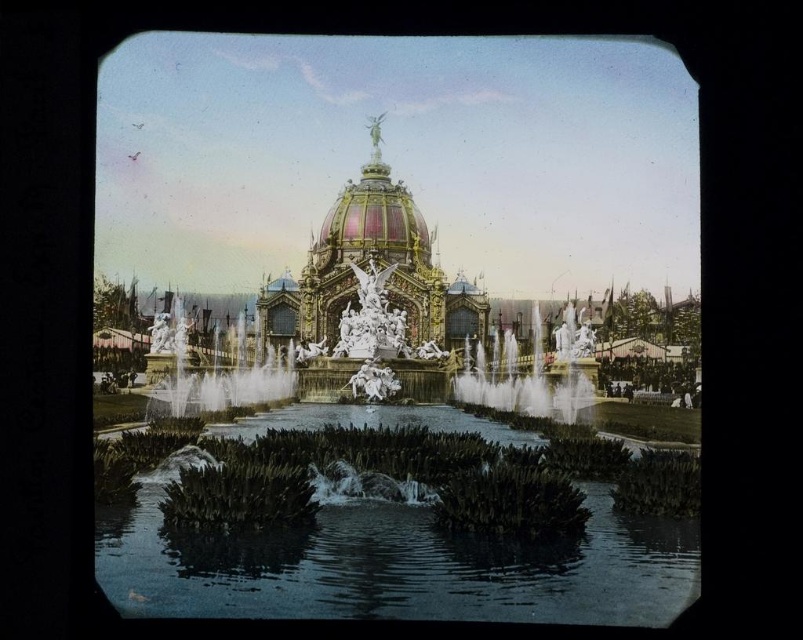
Measure the distance between polished bronze fountain at center and camera.

polished bronze fountain at center and camera are 135.79 meters apart from each other.

Is polished bronze fountain at center in front of white marble fountain at center?

No.

Find the location of a particular element. The width and height of the screenshot is (803, 640). polished bronze fountain at center is located at coordinates (532, 376).

Is point (406, 524) positioned after point (414, 289)?

No, (406, 524) is closer to viewer.

Between point (353, 520) and point (398, 294), which one is positioned behind?

Positioned behind is point (398, 294).

This screenshot has height=640, width=803. Find the location of `clear water at center`. clear water at center is located at coordinates (394, 564).

This screenshot has height=640, width=803. Find the location of `clear water at center`. clear water at center is located at coordinates (394, 564).

Between gold/gilded dome at center and polished bronze fountain at center, which one appears on the left side from the viewer's perspective?

Positioned to the left is gold/gilded dome at center.

Can you confirm if gold/gilded dome at center is positioned below polished bronze fountain at center?

No.

Is point (406, 252) closer to viewer compared to point (577, 392)?

No, (406, 252) is further to viewer.

The height and width of the screenshot is (640, 803). I want to click on gold/gilded dome at center, so click(376, 268).